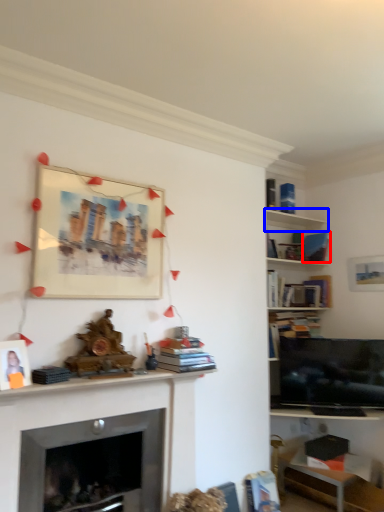
Question: Which of the following is the farthest to the observer, book (highlighted by a red box) or shelf (highlighted by a blue box)?

Choices:
 (A) book
 (B) shelf

Answer: (A)